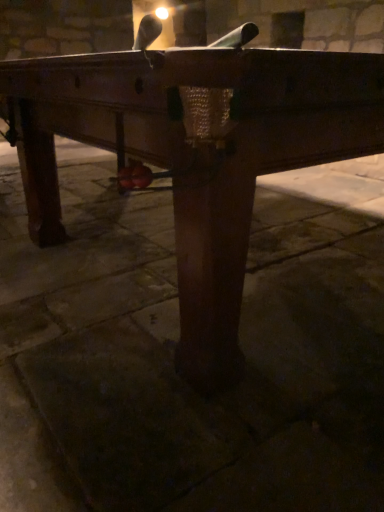
Describe the element at coordinates (196, 152) in the screenshot. This screenshot has height=512, width=384. I see `polished wood pool table at center` at that location.

The height and width of the screenshot is (512, 384). Find the location of `polished wood pool table at center`. polished wood pool table at center is located at coordinates (196, 152).

You are a GUI agent. You are given a task and a screenshot of the screen. Output one action in this format:
    pyautogui.click(x=<x>, y=<y>)
    Task: Click on the polished wood pool table at center
    Image resolution: width=384 pixels, height=512 pixels.
    Given the screenshot: What is the action you would take?
    pyautogui.click(x=196, y=152)